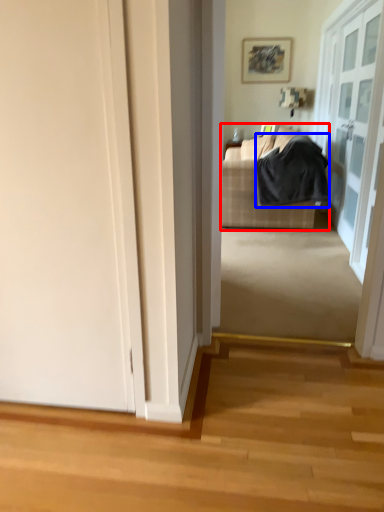
Question: Which object appears farthest to the camera in this image, studio couch (highlighted by a red box) or blanket (highlighted by a blue box)?

Choices:
 (A) studio couch
 (B) blanket

Answer: (A)